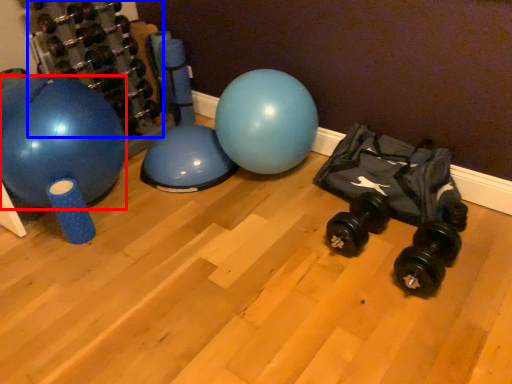
Question: Which point is closer to the camera, ball (highlighted by a red box) or dumbbell (highlighted by a blue box)?

Choices:
 (A) ball
 (B) dumbbell

Answer: (A)